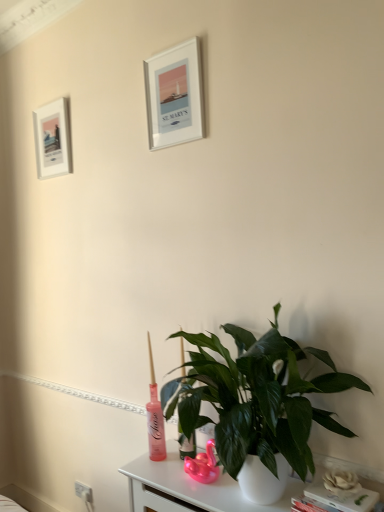
Question: From a real-world perspective, is green glossy plant at lower center positioned above or below white matte flower at lower right?

Choices:
 (A) below
 (B) above

Answer: (B)

Question: Considering the positions of green glossy plant at lower center and white matte flower at lower right in the image, is green glossy plant at lower center wider or thinner than white matte flower at lower right?

Choices:
 (A) wide
 (B) thin

Answer: (A)

Question: Which of these objects is positioned farthest from the white plastic electric outlet at lower left?

Choices:
 (A) white matte picture frame at upper left, which appears as the second picture frame when viewed from the front
 (B) white matte flower at lower right
 (C) green glossy plant at lower center
 (D) white glossy table at lower center
 (E) silver metallic picture frame at upper center, the 2th picture frame positioned from the back

Answer: (E)

Question: Which object is the closest to the white matte picture frame at upper left, which appears as the first picture frame when viewed from the left?

Choices:
 (A) white matte flower at lower right
 (B) green glossy plant at lower center
 (C) white glossy table at lower center
 (D) white plastic electric outlet at lower left
 (E) white matte book at lower right

Answer: (B)